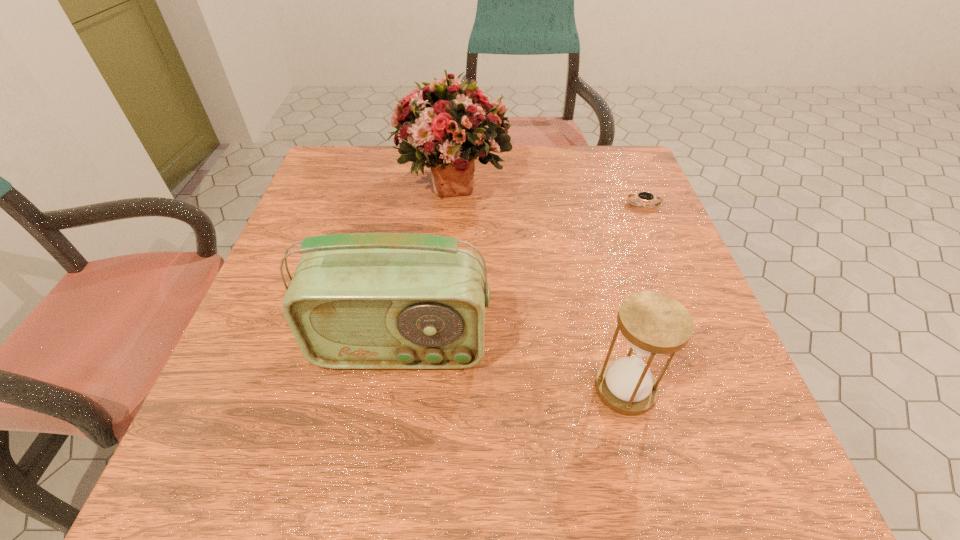
Identify the location of object situated at the far edge. This screenshot has height=540, width=960. (449, 125).

The width and height of the screenshot is (960, 540). What are the coordinates of `object at the left edge` in the screenshot? It's located at (379, 300).

Image resolution: width=960 pixels, height=540 pixels. Find the location of `hourglass that is positioned at the right edge`. hourglass that is positioned at the right edge is located at coordinates (653, 323).

Identify the location of watch that is at the right edge. This screenshot has width=960, height=540. (644, 196).

Identify the location of vacant space at the far edge of the desktop. [546, 156].

The image size is (960, 540). What are the coordinates of `vacant space at the near edge` in the screenshot? It's located at (567, 470).

In the image, there is a desktop. Where is `vacant space at the right edge`? Image resolution: width=960 pixels, height=540 pixels. vacant space at the right edge is located at coordinates (693, 343).

In the image, there is a desktop. Identify the location of vacant space at the far left corner. The width and height of the screenshot is (960, 540). (352, 187).

At what (x,y) coordinates should I click in order to perform the action: click on empty space that is in between the second object from right to left and the bouquet. Please return your answer as a coordinate pair (x, y). Looking at the image, I should click on (539, 285).

This screenshot has height=540, width=960. I want to click on free space between the second object from right to left and the radio receiver, so click(x=513, y=368).